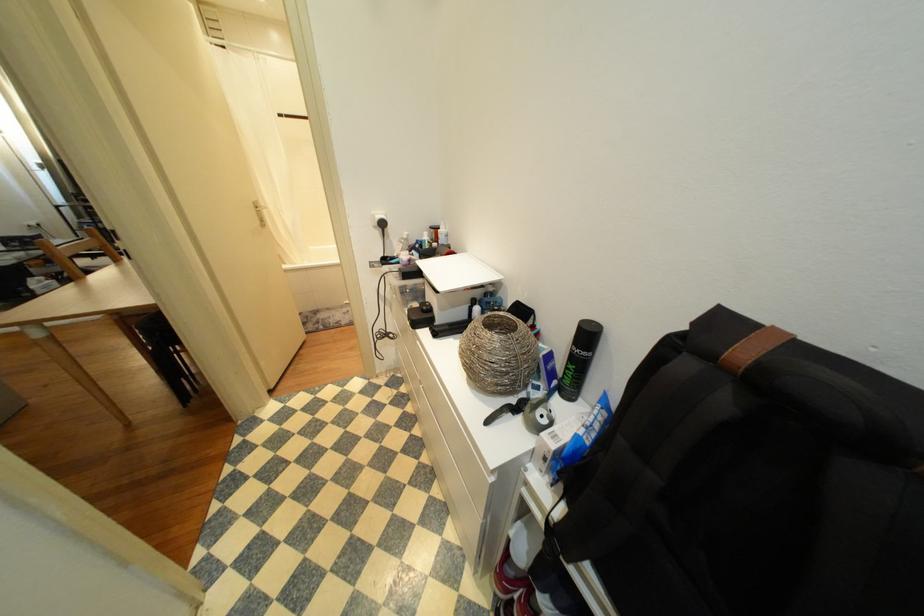
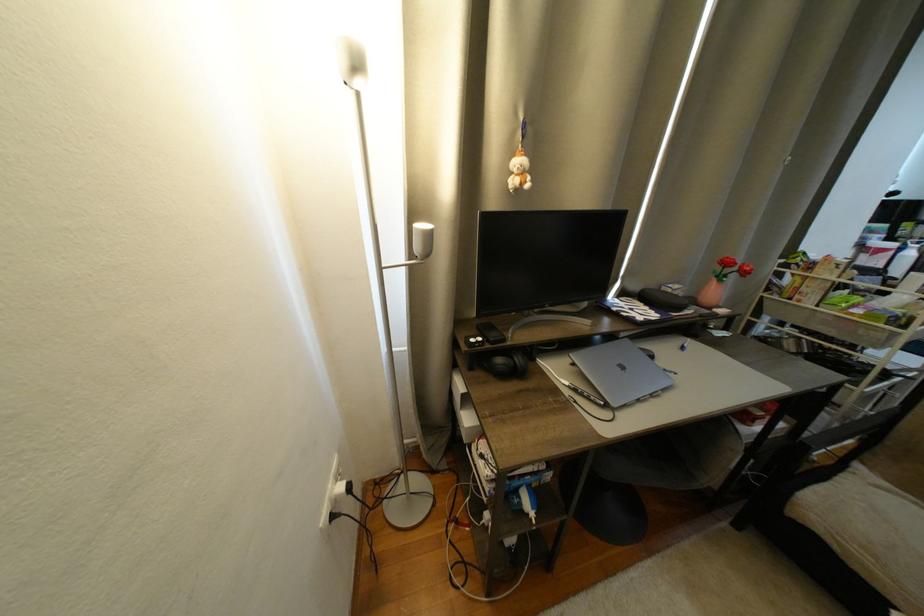
The point at (x=34, y=225) is marked in the first image. Where is the corresponding point in the second image?

(333, 520)